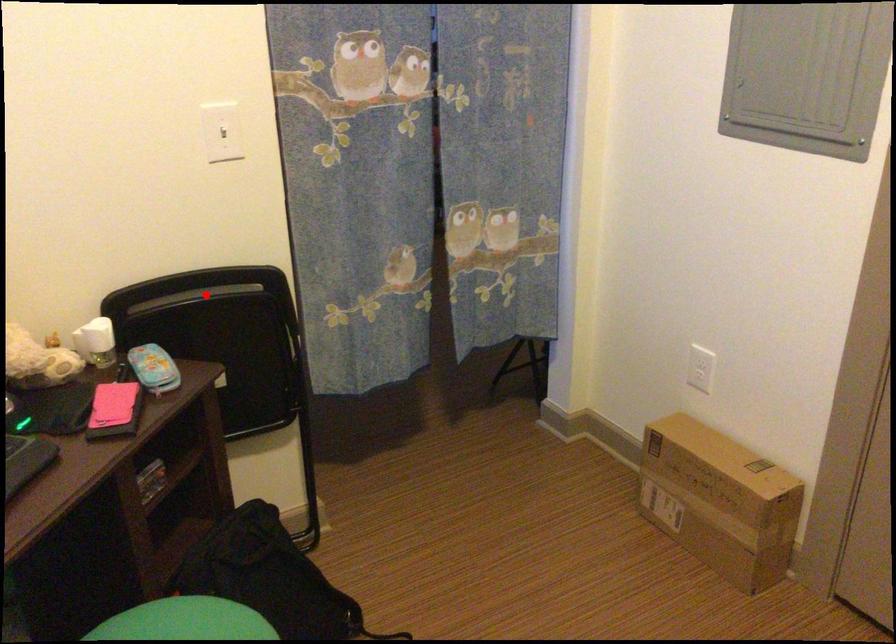
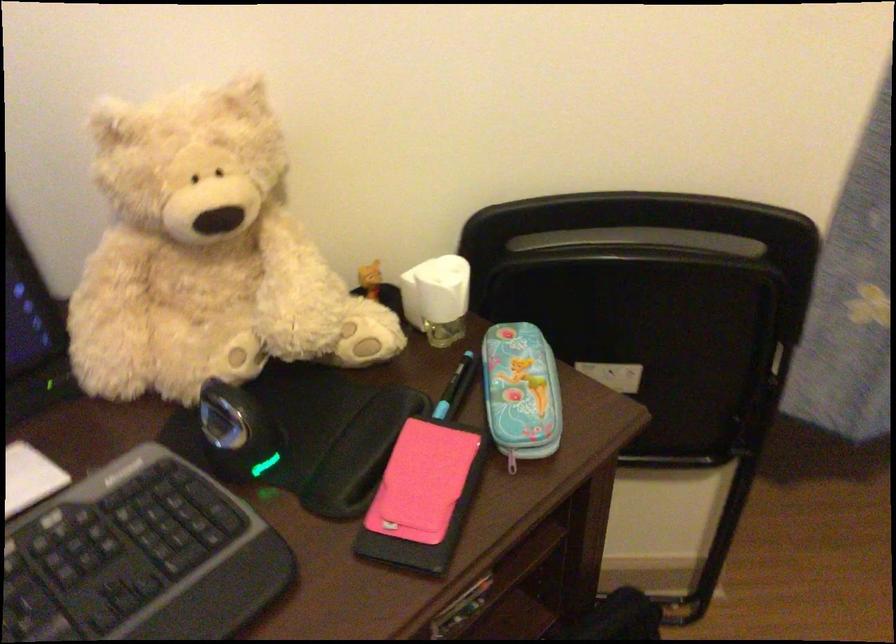
Question: A red point is marked in image1. In image2, is the corresponding 3D point closer to the camera or farther? Reply with the corresponding letter.

Choices:
 (A) The corresponding 3D point is closer.
 (B) The corresponding 3D point is farther.

Answer: (A)